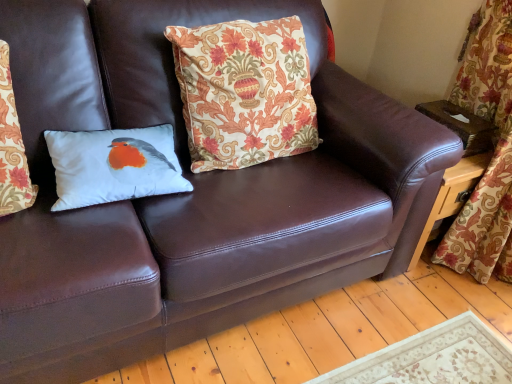
Describe the element at coordinates (114, 165) in the screenshot. I see `white fabric pillow with bird design at left` at that location.

Locate an element on the screen. The image size is (512, 384). white fabric pillow with bird design at left is located at coordinates (114, 165).

You are a GUI agent. You are given a task and a screenshot of the screen. Output one action in this format:
    pyautogui.click(x=<x>, y=<y>)
    Task: Click on the white fabric pillow with bird design at left
    This screenshot has height=384, width=512.
    Given the screenshot: What is the action you would take?
    pyautogui.click(x=114, y=165)